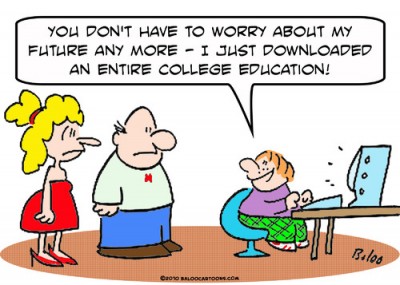
You are a GUI agent. You are given a task and a screenshot of the screen. Output one action in this format:
    pyautogui.click(x=<x>, y=<y>)
    Task: Click on the floor
    Image resolution: width=400 pixels, height=285 pixels.
    Given the screenshot: What is the action you would take?
    pyautogui.click(x=222, y=255)